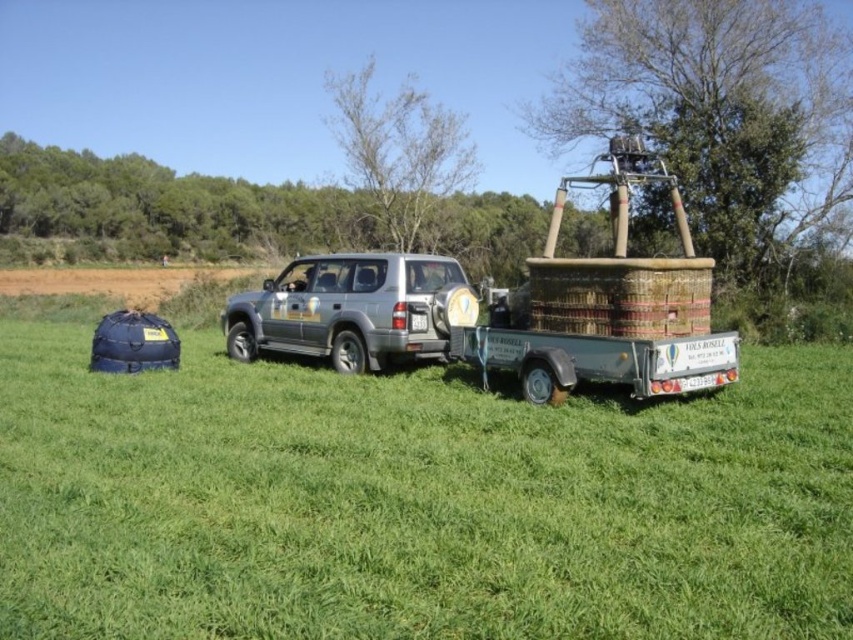
From the picture: You need to park a car that is 2 meters wide. Can the green grassy field at center accommodate the silver metallic suv at center and the car side by side without overlapping?

The green grassy field at center is wider than the silver metallic suv at center, so it can accommodate both the SUV and the car side by side without overlapping.

You are a photographer planning to take a picture of the silver metallic suv at center and the green grassy field at center. Which object will appear larger in the photo?

The silver metallic suv at center will appear larger in the photo because it is taller than the green grassy field at center.

You are a photographer planning to take a photo of the silver metallic suv at center and the green grassy field at center. Which object should you focus on first if you want to capture both in sharp focus, considering their positions?

The green grassy field at center is below the silver metallic suv at center, so you should focus on the silver metallic suv at center first since it is closer to the camera.